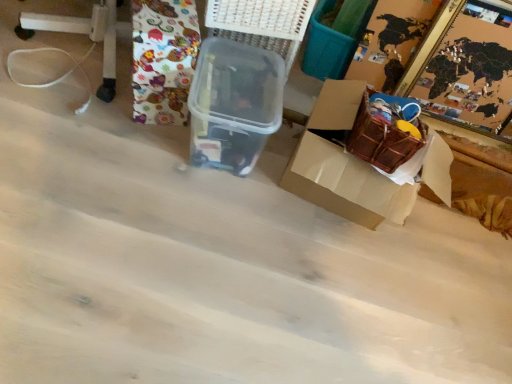
In order to click on free area in between transparent plastic container at center and brown cardboard box at lower right in this screenshot , I will do `click(263, 162)`.